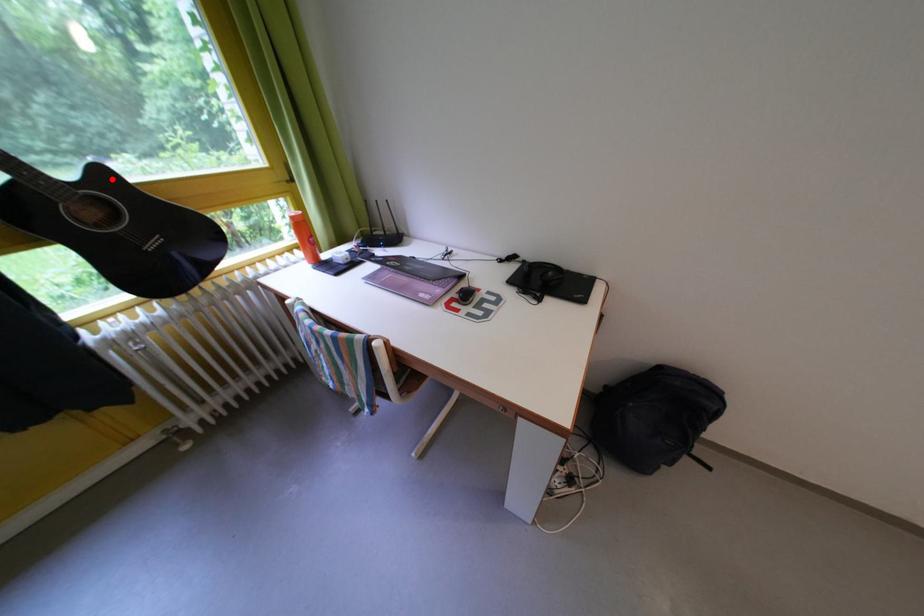
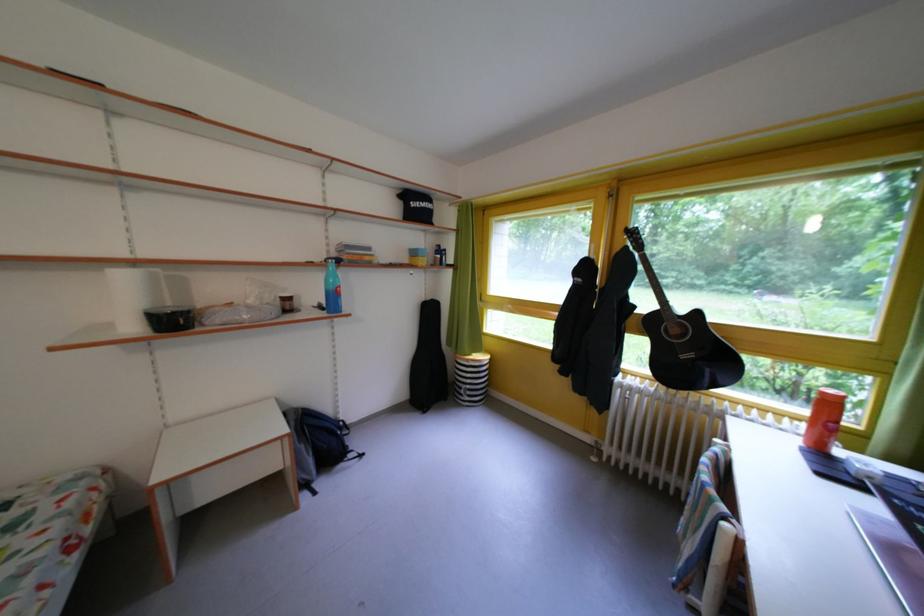
Question: I am providing you with two images of the same scene from different viewpoints. Image1 has a red point marked. In image2, the corresponding 3D location appears at what relative position? Reply with the corresponding letter.

Choices:
 (A) Closer
 (B) Farther

Answer: (B)